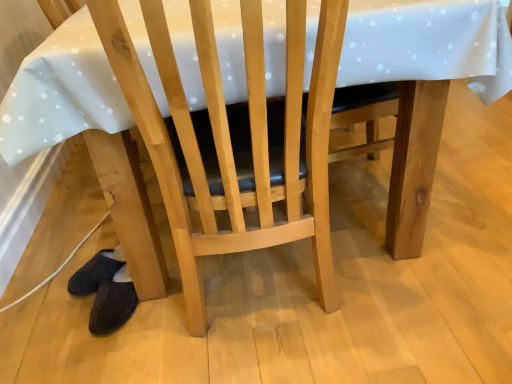
Question: From the image's perspective, relative to dark blue fuzzy slippers at lower left, is wooden chair at center above or below?

Choices:
 (A) above
 (B) below

Answer: (A)

Question: Relative to dark blue fuzzy slippers at lower left, is wooden chair at center in front or behind?

Choices:
 (A) front
 (B) behind

Answer: (A)

Question: In terms of width, does wooden chair at center look wider or thinner when compared to dark blue fuzzy slippers at lower left?

Choices:
 (A) wide
 (B) thin

Answer: (A)

Question: Is dark blue fuzzy slippers at lower left in front of or behind wooden chair at center in the image?

Choices:
 (A) behind
 (B) front

Answer: (A)

Question: In terms of height, does dark blue fuzzy slippers at lower left look taller or shorter compared to wooden chair at center?

Choices:
 (A) tall
 (B) short

Answer: (B)

Question: Is dark blue fuzzy slippers at lower left situated inside wooden chair at center or outside?

Choices:
 (A) inside
 (B) outside

Answer: (B)

Question: Would you say dark blue fuzzy slippers at lower left is to the left or to the right of wooden chair at center in the picture?

Choices:
 (A) right
 (B) left

Answer: (B)